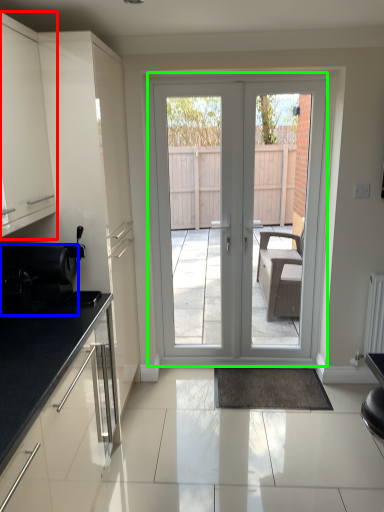
Question: Which object is positioned farthest from cabinetry (highlighted by a red box)? Select from appliance (highlighted by a blue box) and door (highlighted by a green box).

Choices:
 (A) appliance
 (B) door

Answer: (B)